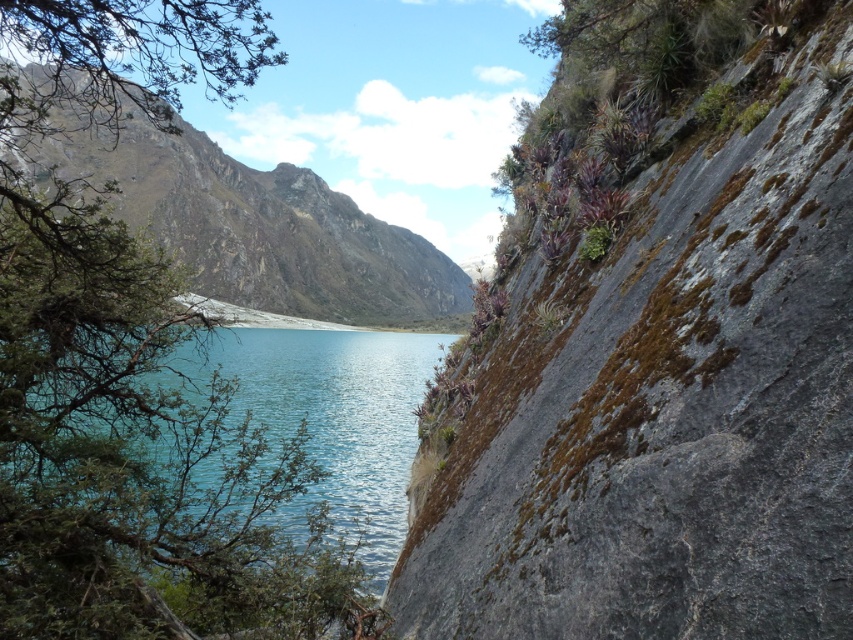
Question: Is rugged stone mountain at center below teal glassy water at center?

Choices:
 (A) no
 (B) yes

Answer: (A)

Question: Does green mossy rock at right come behind teal glassy water at center?

Choices:
 (A) no
 (B) yes

Answer: (A)

Question: Which object appears closest to the camera in this image?

Choices:
 (A) teal glassy water at center
 (B) rugged stone mountain at center
 (C) green mossy rock at right

Answer: (C)

Question: Can you confirm if green mossy rock at right is wider than teal glassy water at center?

Choices:
 (A) yes
 (B) no

Answer: (B)

Question: Which point is closer to the camera?

Choices:
 (A) teal glassy water at center
 (B) green mossy rock at right

Answer: (B)

Question: Among these points, which one is nearest to the camera?

Choices:
 (A) (303, 204)
 (B) (585, 180)

Answer: (B)